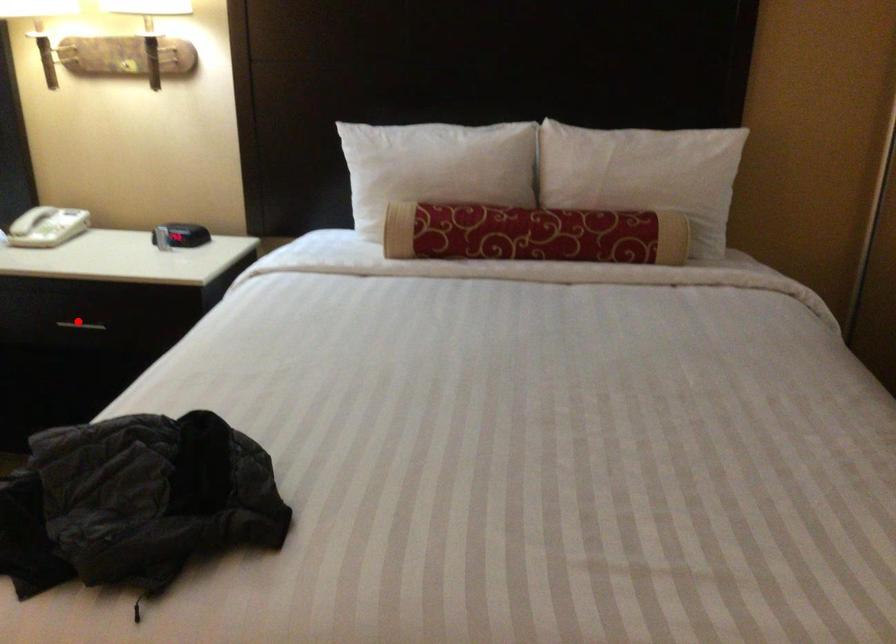
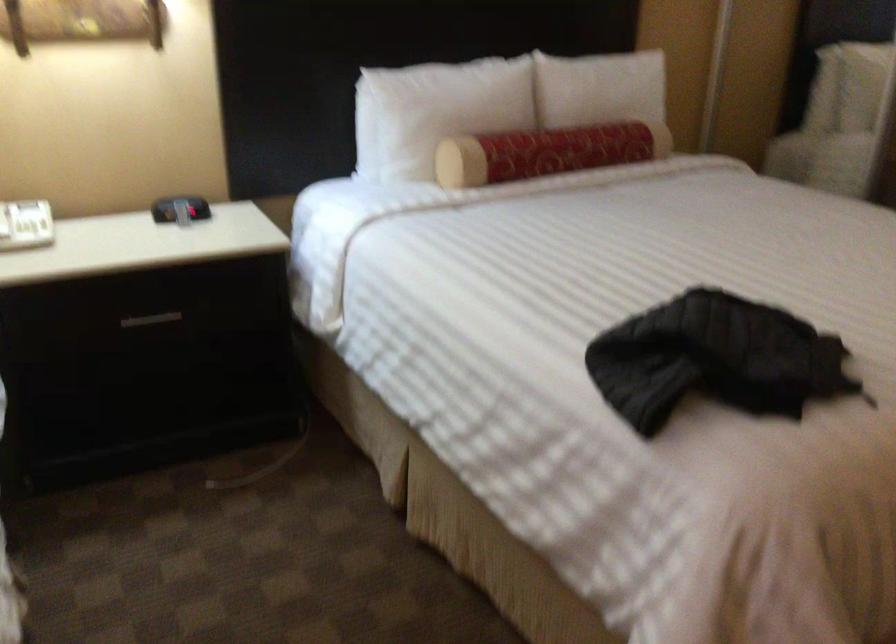
Find the pixel in the second image that matches the highlighted location in the first image.

(151, 319)